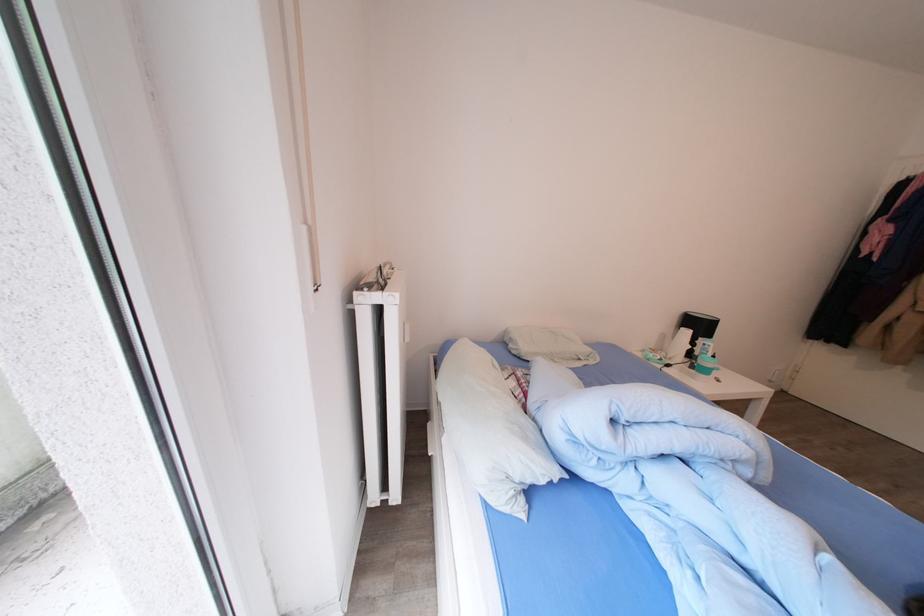
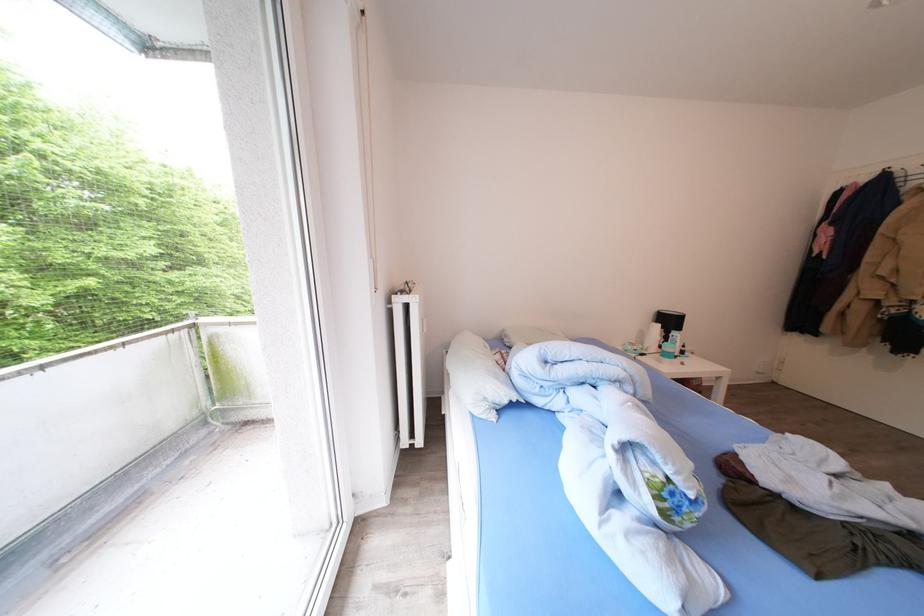
In the second image, find the point that corresponds to point (708, 331) in the first image.

(677, 326)